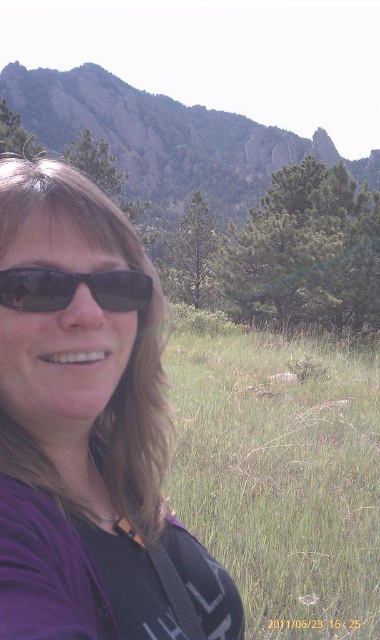
Can you confirm if purple matte shirt at left is smaller than matte black sunglasses at left?

No, purple matte shirt at left is not smaller than matte black sunglasses at left.

Does purple matte shirt at left have a greater height compared to matte black sunglasses at left?

Correct, purple matte shirt at left is much taller as matte black sunglasses at left.

Locate an element on the screen. This screenshot has width=380, height=640. purple matte shirt at left is located at coordinates (87, 426).

The image size is (380, 640). I want to click on purple matte shirt at left, so click(87, 426).

Can you confirm if rugged rock mountain at upper center is positioned above matte black sunglasses at left?

Yes.

Is point (242, 141) behind point (22, 296)?

Yes.

This screenshot has height=640, width=380. I want to click on rugged rock mountain at upper center, so click(166, 140).

How much distance is there between purple matte shirt at left and green grass at center?

purple matte shirt at left is 25.49 feet away from green grass at center.

Measure the distance from purple matte shirt at left to green grass at center.

They are 7.77 meters apart.

Who is more distant from viewer, (9, 486) or (294, 419)?

Positioned behind is point (294, 419).

The image size is (380, 640). Find the location of `purple matte shirt at left`. purple matte shirt at left is located at coordinates (87, 426).